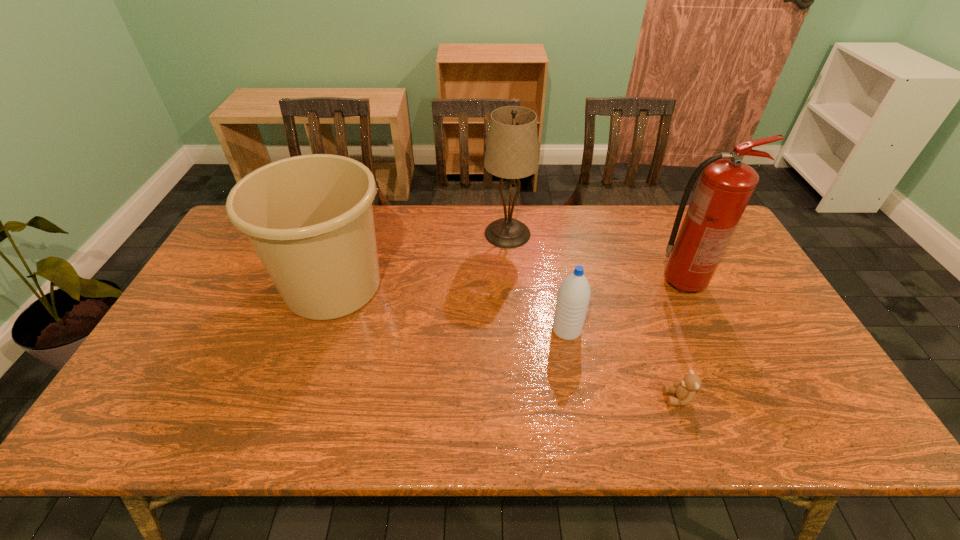
Identify the location of the rightmost object. (726, 184).

You are a GUI agent. You are given a task and a screenshot of the screen. Output one action in this format:
    pyautogui.click(x=<x>, y=<y>)
    Task: Click on the lampshade
    
    Given the screenshot: What is the action you would take?
    pyautogui.click(x=511, y=152)

Locate an element on the screen. the leftmost object is located at coordinates (309, 218).

What are the coordinates of `the third shortest object` in the screenshot? It's located at (309, 218).

The height and width of the screenshot is (540, 960). Identify the location of water bottle. (573, 298).

You are a GUI agent. You are given a task and a screenshot of the screen. Output one action in this format:
    pyautogui.click(x=<x>, y=<y>)
    Task: Click on the second shortest object
    The width and height of the screenshot is (960, 540).
    Given the screenshot: What is the action you would take?
    pyautogui.click(x=573, y=298)

Identify the location of the shortest object. (685, 390).

Where is `the fourth object from left to right`? The image size is (960, 540). the fourth object from left to right is located at coordinates (685, 390).

Locate an element on the screen. free spot located on the handle side the fire extinguisher is located at coordinates (739, 282).

Locate an element on the screen. The height and width of the screenshot is (540, 960). vacant space located 0.180m on the front-facing side of the lampshade is located at coordinates (429, 234).